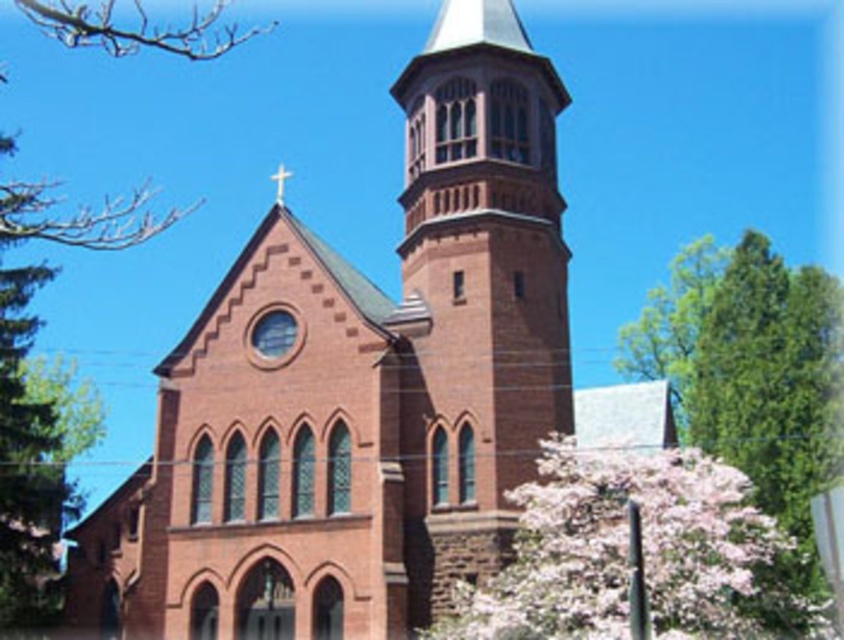
Between pink blossoms at lower right and smooth wooden cross at upper center, which one appears on the right side from the viewer's perspective?

pink blossoms at lower right is more to the right.

Is point (474, 630) positioned after point (291, 173)?

No, it is in front of (291, 173).

Locate an element on the screen. Image resolution: width=844 pixels, height=640 pixels. pink blossoms at lower right is located at coordinates (642, 556).

Is point (494, 1) positioned before point (280, 188)?

Yes, point (494, 1) is closer to viewer.

How far apart are red brick church at center and smooth wooden cross at upper center?

red brick church at center and smooth wooden cross at upper center are 16.64 meters apart from each other.

Is point (204, 412) farther from viewer compared to point (273, 176)?

No, it is in front of (273, 176).

The width and height of the screenshot is (844, 640). Identify the location of red brick church at center. (366, 388).

Does red brick church at center appear on the left side of pink blossoms at lower right?

Correct, you'll find red brick church at center to the left of pink blossoms at lower right.

Who is positioned more to the right, red brick church at center or pink blossoms at lower right?

pink blossoms at lower right

Which is behind, point (475, 531) or point (592, 531)?

The point (475, 531) is more distant.

Where is `red brick church at center`? Image resolution: width=844 pixels, height=640 pixels. red brick church at center is located at coordinates (366, 388).